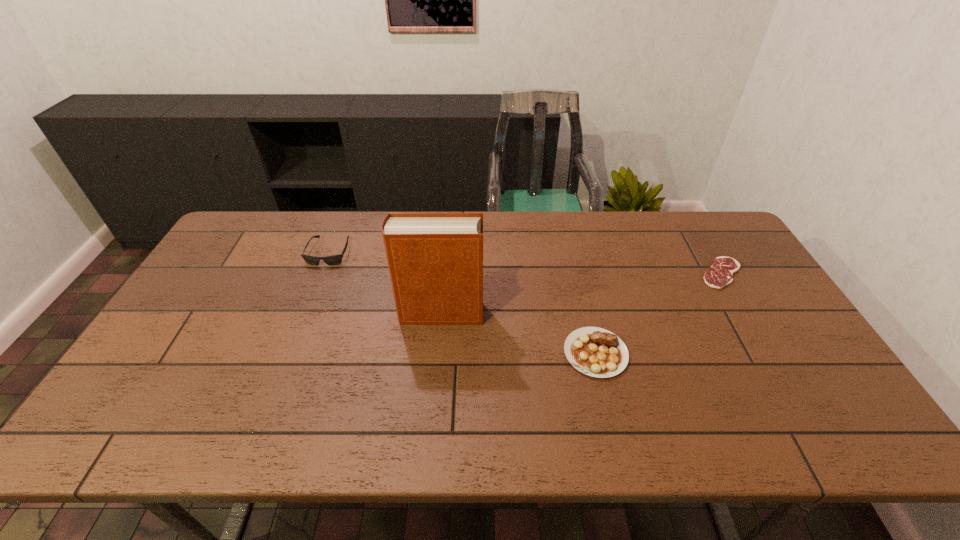
I want to click on free space between the third farthest object and the leftmost object, so click(385, 282).

Locate an element on the screen. free space that is in between the shortest object and the hardback book is located at coordinates point(581,293).

Locate an element on the screen. This screenshot has width=960, height=540. vacant space in between the shorter steak and the nearest object is located at coordinates (659, 313).

What are the coordinates of `free spot between the farther steak and the third object from right to left` in the screenshot? It's located at (581, 293).

The image size is (960, 540). What are the coordinates of `vacant space that is in between the tallest object and the shorter steak` in the screenshot? It's located at (581, 293).

Where is `free space between the leftmost object and the tallest object`? This screenshot has height=540, width=960. free space between the leftmost object and the tallest object is located at coordinates (385, 282).

Identify which object is the third nearest to the second nearest object. Please provide its 2D coordinates. Your answer should be formatted as a tuple, i.e. [(x, y)], where the tuple contains the x and y coordinates of a point satisfying the conditions above.

[(720, 274)]

Find the location of a particular element. This screenshot has height=540, width=960. the second closest object to the hardback book is located at coordinates (334, 259).

This screenshot has width=960, height=540. Identify the location of free spot that satisfies the following two spatial constraints: 1. on the front-facing side of the sunglasses; 2. on the left side of the farther steak. click(321, 273).

This screenshot has height=540, width=960. What are the coordinates of `vacant area in the image that satisfies the following two spatial constraints: 1. on the front-facing side of the third shortest object; 2. on the right side of the shortest object` in the screenshot? It's located at (321, 273).